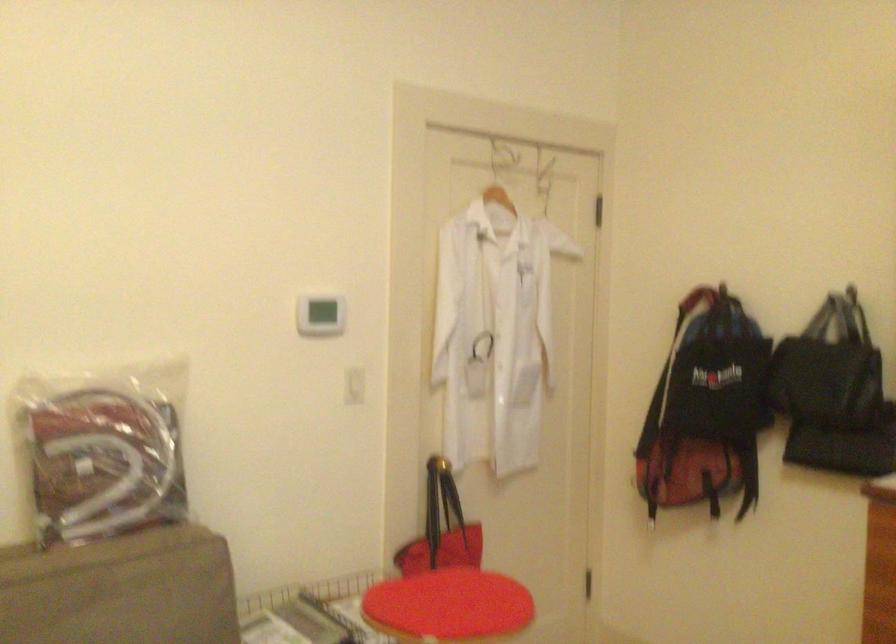
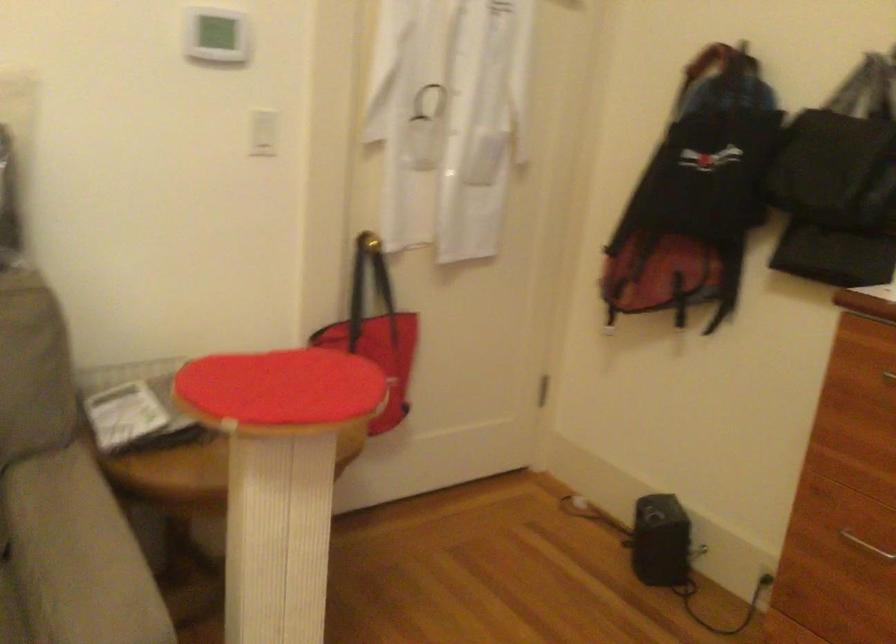
What movement of the cameraman would produce the second image?

The cameraman moved toward right, forward.